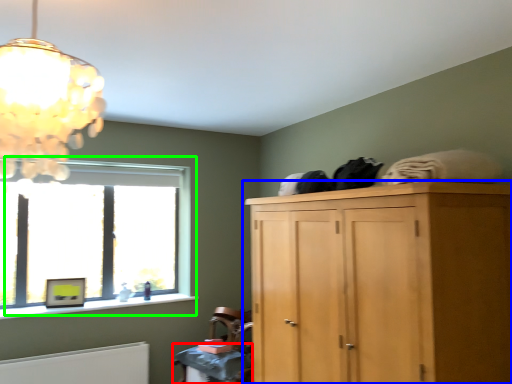
Question: Estimate the real-world distances between objects in this image. Which object is closer to table (highlighted by a red box), cupboard (highlighted by a blue box) or window (highlighted by a green box)?

Choices:
 (A) cupboard
 (B) window

Answer: (A)